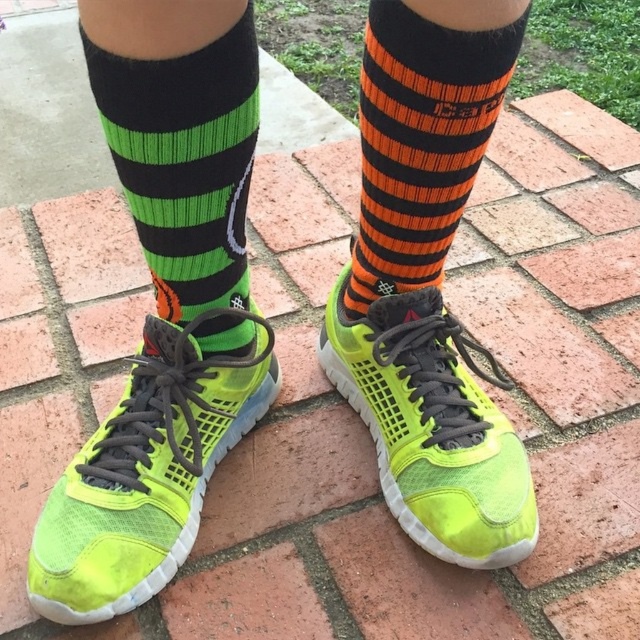
Question: Is neon green mesh shoe at lower left further to the viewer compared to orange striped sock at upper right?

Choices:
 (A) yes
 (B) no

Answer: (A)

Question: Which point appears farthest from the camera in this image?

Choices:
 (A) (380, 138)
 (B) (477, 477)

Answer: (B)

Question: Which object is positioned closest to the green knitted sock at left?

Choices:
 (A) neon green mesh shoe at center
 (B) orange striped sock at upper right

Answer: (B)

Question: Does neon green mesh shoe at lower left have a larger size compared to green knitted sock at left?

Choices:
 (A) yes
 (B) no

Answer: (A)

Question: Can you confirm if green knitted sock at left is wider than orange striped sock at upper right?

Choices:
 (A) yes
 (B) no

Answer: (A)

Question: Considering the real-world distances, which object is closest to the green knitted sock at left?

Choices:
 (A) orange striped sock at upper right
 (B) neon green mesh shoe at lower left

Answer: (B)